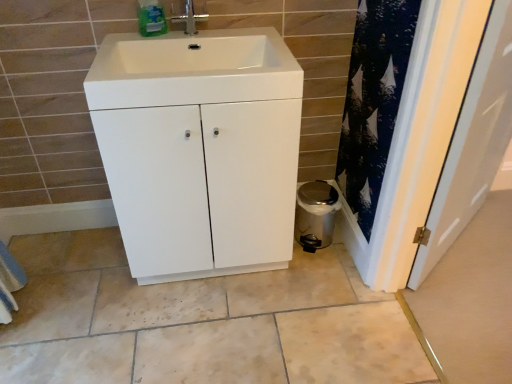
Find the location of `green plastic bottle at upper center`. green plastic bottle at upper center is located at coordinates (151, 18).

At what (x,y) coordinates should I click in order to perform the action: click on white matte cabinet at center. Please return your answer as a coordinate pair (x, y). Looking at the image, I should click on (199, 149).

Where is `white glossy door at right`? The height and width of the screenshot is (384, 512). white glossy door at right is located at coordinates tap(473, 143).

Describe the element at coordinates (315, 215) in the screenshot. Image resolution: width=512 pixels, height=384 pixels. I see `metallic trash can at lower right` at that location.

What is the approximate height of metallic trash can at lower right?

11.82 inches.

Where is `green plastic bottle at upper center`? The width and height of the screenshot is (512, 384). green plastic bottle at upper center is located at coordinates (151, 18).

Relative to white glossy sink at center, is green plastic bottle at upper center in front or behind?

Visually, green plastic bottle at upper center is located behind white glossy sink at center.

From a real-world perspective, is green plastic bottle at upper center positioned above or below white glossy sink at center?

Clearly, from a real-world perspective, green plastic bottle at upper center is above white glossy sink at center.

From the image's perspective, relative to white glossy sink at center, is green plastic bottle at upper center above or below?

Clearly, from the image's perspective, green plastic bottle at upper center is above white glossy sink at center.

From the picture: Can we say green plastic bottle at upper center lies outside white glossy sink at center?

That's correct, green plastic bottle at upper center is outside of white glossy sink at center.

Does green plastic bottle at upper center have a smaller size compared to white matte cabinet at center?

Indeed, green plastic bottle at upper center has a smaller size compared to white matte cabinet at center.

Does green plastic bottle at upper center appear on the right side of white matte cabinet at center?

In fact, green plastic bottle at upper center is to the left of white matte cabinet at center.

The width and height of the screenshot is (512, 384). Find the location of `bottle above the white matte cabinet at center (from a real-world perspective)`. bottle above the white matte cabinet at center (from a real-world perspective) is located at coordinates (151, 18).

Is silver metallic tap at upper center positioned with its back to metallic trash can at lower right?

No, silver metallic tap at upper center's orientation is not away from metallic trash can at lower right.

Is metallic trash can at lower right completely or partially inside silver metallic tap at upper center?

No.

From a real-world perspective, which is physically above, silver metallic tap at upper center or metallic trash can at lower right?

In real-world perspective, silver metallic tap at upper center is above.

Is white matte cabinet at center not within silver metallic tap at upper center?

Yes, white matte cabinet at center is not within silver metallic tap at upper center.

From a real-world perspective, which object stands above the other?

In real-world perspective, silver metallic tap at upper center is above.

Which of these two, white matte cabinet at center or silver metallic tap at upper center, is thinner?

Thinner between the two is silver metallic tap at upper center.

Which point is more forward, (145, 60) or (186, 2)?

The point (186, 2) is closer.

Is silver metallic tap at upper center at the back of metallic trash can at lower right?

No, metallic trash can at lower right's orientation is not away from silver metallic tap at upper center.

Considering the positions of points (321, 214) and (173, 21), is point (321, 214) farther from camera compared to point (173, 21)?

Yes, it is behind point (173, 21).

From the image's perspective, relative to silver metallic tap at upper center, is metallic trash can at lower right above or below?

metallic trash can at lower right is below silver metallic tap at upper center.

Can you confirm if metallic trash can at lower right is shorter than silver metallic tap at upper center?

No, metallic trash can at lower right is not shorter than silver metallic tap at upper center.

Which is in front, point (139, 10) or point (178, 18)?

The point (139, 10) is more forward.

Who is more distant, green plastic bottle at upper center or silver metallic tap at upper center?

silver metallic tap at upper center is further away from the camera.

Considering the relative sizes of green plastic bottle at upper center and silver metallic tap at upper center in the image provided, is green plastic bottle at upper center bigger than silver metallic tap at upper center?

Indeed, green plastic bottle at upper center has a larger size compared to silver metallic tap at upper center.

Considering the relative sizes of white glossy door at right and green plastic bottle at upper center in the image provided, is white glossy door at right bigger than green plastic bottle at upper center?

Yes, white glossy door at right is bigger than green plastic bottle at upper center.

Is white glossy door at right outside of green plastic bottle at upper center?

Yes.

Which is behind, white glossy door at right or green plastic bottle at upper center?

green plastic bottle at upper center is more distant.

Identify the location of bottle that appears above the white glossy sink at center (from a real-world perspective). (151, 18).

This screenshot has height=384, width=512. What are the coordinates of `bathroom cabinet below the green plastic bottle at upper center (from a real-world perspective)` in the screenshot? It's located at (199, 149).

Based on the photo, based on their spatial positions, is white glossy sink at center or silver metallic tap at upper center closer to metallic trash can at lower right?

white glossy sink at center is closer to metallic trash can at lower right.

Considering their positions, is silver metallic tap at upper center positioned closer to white glossy door at right than green plastic bottle at upper center?

Based on the image, silver metallic tap at upper center appears to be nearer to white glossy door at right.

Which object lies further to the anchor point white matte cabinet at center, white glossy sink at center or white glossy door at right?

Among the two, white glossy door at right is located further to white matte cabinet at center.

Considering their positions, is silver metallic tap at upper center positioned further to white matte cabinet at center than metallic trash can at lower right?

metallic trash can at lower right.

From the image, which object appears to be farther from white glossy door at right, metallic trash can at lower right or white matte cabinet at center?

The object further to white glossy door at right is white matte cabinet at center.

From the image, which object appears to be nearer to white glossy sink at center, silver metallic tap at upper center or white glossy door at right?

silver metallic tap at upper center.

Estimate the real-world distances between objects in this image. Which object is further from white glossy sink at center, white glossy door at right or white matte cabinet at center?

Based on the image, white glossy door at right appears to be further to white glossy sink at center.

Consider the image. From the image, which object appears to be nearer to silver metallic tap at upper center, green plastic bottle at upper center or metallic trash can at lower right?

green plastic bottle at upper center.

Identify the location of bathroom cabinet between white glossy sink at center and white glossy door at right in the horizontal direction. (199, 149).

The image size is (512, 384). I want to click on bottle between silver metallic tap at upper center and white glossy sink at center vertically, so pyautogui.click(x=151, y=18).

Identify the location of sink between green plastic bottle at upper center and white glossy door at right. (192, 69).

Where is `bathroom cabinet between green plastic bottle at upper center and white glossy door at right from left to right`? The image size is (512, 384). bathroom cabinet between green plastic bottle at upper center and white glossy door at right from left to right is located at coordinates (199, 149).